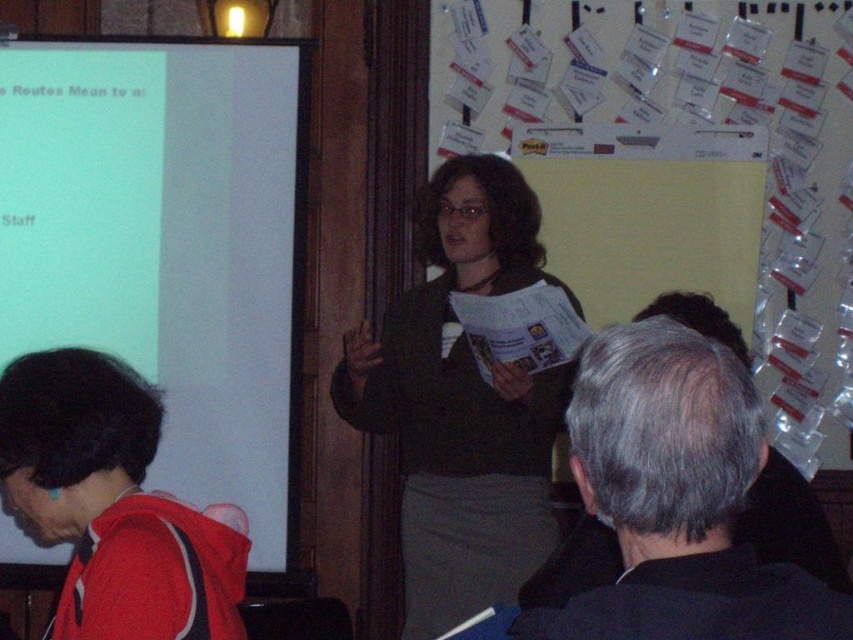
You are a participant in the meeting and need to refer to the white paperboard at upper center and the gray hair at upper right. Which object is located to the left of the other?

The white paperboard at upper center is to the right of gray hair at upper right, so the gray hair at upper right is to the left of the white paperboard at upper center.

You are organizing a presentation in the conference room and need to hang a 1.2 meter tall poster. The white paperboard at upper center and the red fleece jacket at lower left are in the way. Which object must you move to accommodate the poster?

The white paperboard at upper center is taller than the red fleece jacket at lower left. Since the poster is 1.2 meters tall, you must move the white paperboard at upper center because it is taller and would block the poster.

You are an attendee at this presentation. You need to write a note on the white paperboard at upper center but your red fleece jacket at lower left is blocking your path. Can you move the jacket to access the board?

The white paperboard at upper center might be wider than red fleece jacket at lower left, so it is possible that the jacket is narrower than the board. However, since the exact width difference isn not specified, you should check if there is enough space to move the red fleece jacket at lower left aside to access the white paperboard at upper center.